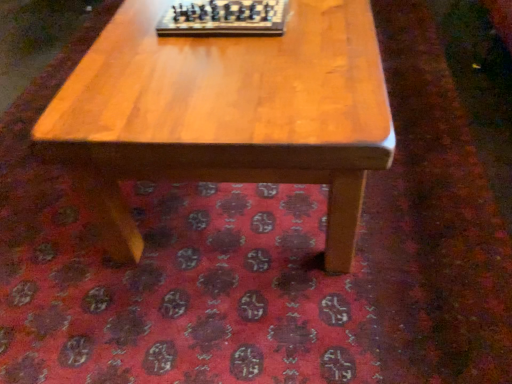
At what (x,y) coordinates should I click in order to perform the action: click on free spot in front of wooden chessboard at center. Please return your answer as a coordinate pair (x, y). Image resolution: width=512 pixels, height=384 pixels. Looking at the image, I should click on (232, 69).